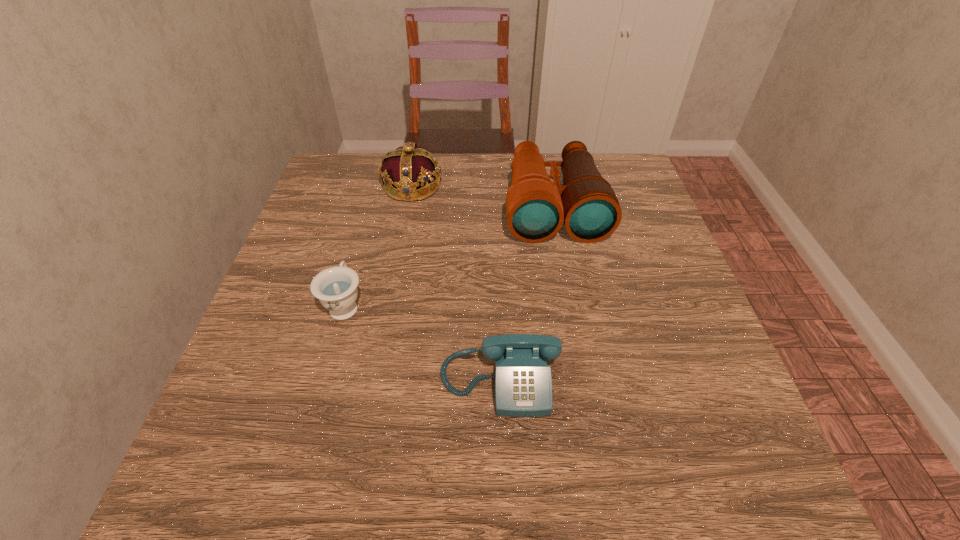
You are a GUI agent. You are given a task and a screenshot of the screen. Output one action in this format:
    pyautogui.click(x=<x>, y=<y>)
    Task: Click on the binoculars present at the far edge
    Image resolution: width=960 pixels, height=540 pixels.
    Given the screenshot: What is the action you would take?
    pyautogui.click(x=536, y=207)

This screenshot has width=960, height=540. Find the location of `crown at the far edge`. crown at the far edge is located at coordinates coord(403,171).

You are a GUI agent. You are given a task and a screenshot of the screen. Output one action in this format:
    pyautogui.click(x=<x>, y=<y>)
    Task: Click on the object located in the left edge section of the desktop
    The width and height of the screenshot is (960, 540).
    Given the screenshot: What is the action you would take?
    pyautogui.click(x=336, y=287)

At what (x,y) coordinates should I click in order to perform the action: click on object at the right edge. Please return your answer as a coordinate pair (x, y). Looking at the image, I should click on (536, 207).

I want to click on object located at the far right corner, so click(x=536, y=207).

Identify the location of vacant position at the far edge of the desktop. (549, 168).

The height and width of the screenshot is (540, 960). I want to click on vacant space at the near edge, so click(501, 449).

Locate an element on the screen. The height and width of the screenshot is (540, 960). free region at the left edge of the desktop is located at coordinates (277, 322).

In the image, there is a desktop. Where is `vacant space at the right edge`? This screenshot has height=540, width=960. vacant space at the right edge is located at coordinates (656, 250).

The height and width of the screenshot is (540, 960). Identify the location of free space at the far left corner of the desktop. (344, 165).